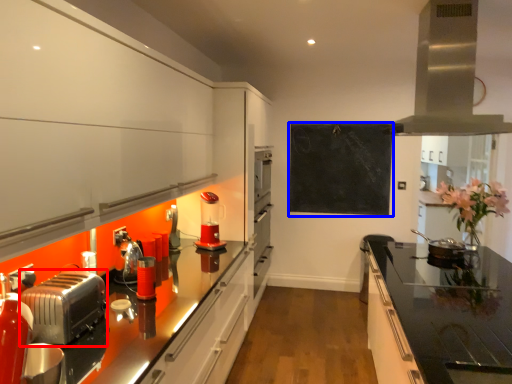
Question: Which object is further to the camera taking this photo, toaster (highlighted by a red box) or bulletin board (highlighted by a blue box)?

Choices:
 (A) toaster
 (B) bulletin board

Answer: (B)